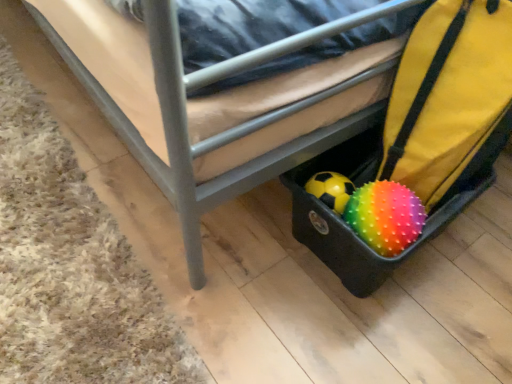
This screenshot has height=384, width=512. Describe the element at coordinates (70, 266) in the screenshot. I see `brown carpet at lower left` at that location.

In order to face rubberized black suitcase at lower right, should I rotate leftwards or rightwards?

You should look right and rotate roughly 15.242 degrees.

I want to click on rainbow spiky ball at lower right, so click(x=385, y=216).

Between brown carpet at lower left and rubberized black suitcase at lower right, which one has less height?

Standing shorter between the two is brown carpet at lower left.

In the scene shown: Looking at their sizes, would you say brown carpet at lower left is wider or thinner than rubberized black suitcase at lower right?

In the image, brown carpet at lower left appears to be wider than rubberized black suitcase at lower right.

I want to click on luggage on the right of the brown carpet at lower left, so click(x=419, y=135).

From a real-world perspective, who is located higher, brown carpet at lower left or rubberized black suitcase at lower right?

rubberized black suitcase at lower right is physically above.

Considering the sizes of objects black plastic suitcase at lower right and rubberized black suitcase at lower right in the image provided, who is wider, black plastic suitcase at lower right or rubberized black suitcase at lower right?

black plastic suitcase at lower right.

Can you tell me how much black plastic suitcase at lower right and rubberized black suitcase at lower right differ in facing direction?

The angular difference between black plastic suitcase at lower right and rubberized black suitcase at lower right is 92.8 degrees.

Between point (371, 9) and point (321, 168), which one is positioned behind?

The point (321, 168) is farther from the camera.

From the image's perspective, between black plastic suitcase at lower right and rubberized black suitcase at lower right, which one is located above?

From the image's view, black plastic suitcase at lower right is above.

From the image's perspective, who appears lower, black plastic suitcase at lower right or rainbow spiky ball at lower right?

rainbow spiky ball at lower right is shown below in the image.

Based on the photo, does black plastic suitcase at lower right have a larger size compared to rainbow spiky ball at lower right?

Indeed, black plastic suitcase at lower right has a larger size compared to rainbow spiky ball at lower right.

In terms of width, does black plastic suitcase at lower right look wider or thinner when compared to rainbow spiky ball at lower right?

In the image, black plastic suitcase at lower right appears to be wider than rainbow spiky ball at lower right.

In terms of height, does black plastic suitcase at lower right look taller or shorter compared to rainbow spiky ball at lower right?

Considering their sizes, black plastic suitcase at lower right has more height than rainbow spiky ball at lower right.

In the scene shown: Considering the positions of objects rainbow spiky ball at lower right and black plastic suitcase at lower right in the image provided, who is in front, rainbow spiky ball at lower right or black plastic suitcase at lower right?

black plastic suitcase at lower right.

The height and width of the screenshot is (384, 512). Find the location of `ball below the black plastic suitcase at lower right (from the image's perspective)`. ball below the black plastic suitcase at lower right (from the image's perspective) is located at coordinates (385, 216).

Is point (410, 234) in front of point (315, 141)?

Yes.

From the image's perspective, does rainbow spiky ball at lower right appear lower than black plastic suitcase at lower right?

Yes, from the image's perspective, rainbow spiky ball at lower right is beneath black plastic suitcase at lower right.

Would you say black plastic suitcase at lower right is inside or outside brown carpet at lower left?

black plastic suitcase at lower right lies outside brown carpet at lower left.

Between black plastic suitcase at lower right and brown carpet at lower left, which one has larger width?

black plastic suitcase at lower right is wider.

Considering the sizes of objects black plastic suitcase at lower right and brown carpet at lower left in the image provided, who is shorter, black plastic suitcase at lower right or brown carpet at lower left?

brown carpet at lower left.

Can black plastic suitcase at lower right be found inside brown carpet at lower left?

Definitely not — black plastic suitcase at lower right is not inside brown carpet at lower left.

From a real-world perspective, which is physically above, brown carpet at lower left or black plastic suitcase at lower right?

black plastic suitcase at lower right, from a real-world perspective.

Can you see brown carpet at lower left touching black plastic suitcase at lower right?

There is a gap between brown carpet at lower left and black plastic suitcase at lower right.

Considering the points (2, 161) and (103, 101), which point is behind, point (2, 161) or point (103, 101)?

The point (2, 161) is farther from the camera.

You are a GUI agent. You are given a task and a screenshot of the screen. Output one action in this format:
    pyautogui.click(x=<x>, y=<y>)
    Task: Click on the ball below the rubberized black suitcase at lower right (from the image's perspective)
    This screenshot has height=384, width=512.
    Given the screenshot: What is the action you would take?
    pyautogui.click(x=385, y=216)

Is rubberized black suitcase at lower right completely or partially outside of rainbow spiky ball at lower right?

Yes, rubberized black suitcase at lower right is not within rainbow spiky ball at lower right.

Is rubberized black suitcase at lower right placed right next to rainbow spiky ball at lower right?

No, rubberized black suitcase at lower right is not making contact with rainbow spiky ball at lower right.

Considering their positions, is rubberized black suitcase at lower right located in front of or behind rainbow spiky ball at lower right?

Clearly, rubberized black suitcase at lower right is behind rainbow spiky ball at lower right.

The height and width of the screenshot is (384, 512). I want to click on mat located in front of the rubberized black suitcase at lower right, so click(70, 266).

I want to click on luggage behind the black plastic suitcase at lower right, so click(419, 135).

In the scene shown: When comparing their distances from black plastic suitcase at lower right, does rubberized black suitcase at lower right or brown carpet at lower left seem further?

The object further to black plastic suitcase at lower right is brown carpet at lower left.

Considering their positions, is rainbow spiky ball at lower right positioned further to rubberized black suitcase at lower right than black plastic suitcase at lower right?

black plastic suitcase at lower right lies further to rubberized black suitcase at lower right than the other object.

Considering their positions, is rubberized black suitcase at lower right positioned further to black plastic suitcase at lower right than rainbow spiky ball at lower right?

rainbow spiky ball at lower right is positioned further to the anchor black plastic suitcase at lower right.

Considering their positions, is black plastic suitcase at lower right positioned further to brown carpet at lower left than rubberized black suitcase at lower right?

rubberized black suitcase at lower right lies further to brown carpet at lower left than the other object.

Considering their positions, is black plastic suitcase at lower right positioned closer to rainbow spiky ball at lower right than rubberized black suitcase at lower right?

Based on the image, rubberized black suitcase at lower right appears to be nearer to rainbow spiky ball at lower right.

When comparing their distances from rainbow spiky ball at lower right, does rubberized black suitcase at lower right or black plastic suitcase at lower right seem further?

black plastic suitcase at lower right is further to rainbow spiky ball at lower right.

Looking at this image, based on their spatial positions, is rubberized black suitcase at lower right or brown carpet at lower left further from rainbow spiky ball at lower right?

brown carpet at lower left.

When comparing their distances from rubberized black suitcase at lower right, does brown carpet at lower left or black plastic suitcase at lower right seem further?

brown carpet at lower left lies further to rubberized black suitcase at lower right than the other object.

Find the location of a particular element. Image resolution: width=512 pixels, height=384 pixels. furniture between brown carpet at lower left and rubberized black suitcase at lower right is located at coordinates (225, 131).

I want to click on furniture located between brown carpet at lower left and rainbow spiky ball at lower right in the left-right direction, so click(x=225, y=131).

You are a GUI agent. You are given a task and a screenshot of the screen. Output one action in this format:
    pyautogui.click(x=<x>, y=<y>)
    Task: Click on the ball located between brown carpet at lower left and rubberized black suitcase at lower right in the left-right direction
    The width and height of the screenshot is (512, 384).
    Given the screenshot: What is the action you would take?
    tap(385, 216)

Identify the location of luggage between black plastic suitcase at lower right and rainbow spiky ball at lower right in the up-down direction. This screenshot has width=512, height=384. (419, 135).